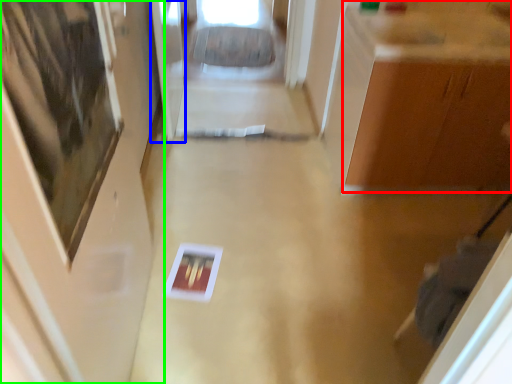
Question: Which is farther away from cabinetry (highlighted by a red box)? glass door (highlighted by a blue box) or door (highlighted by a green box)?

Choices:
 (A) glass door
 (B) door

Answer: (A)